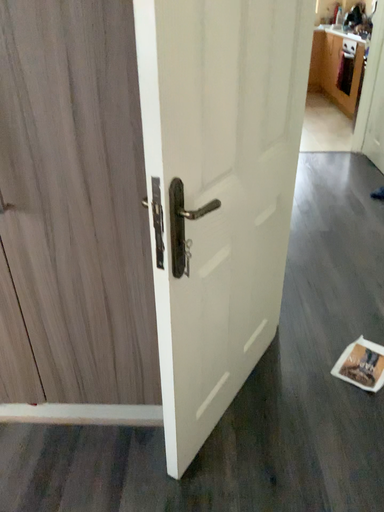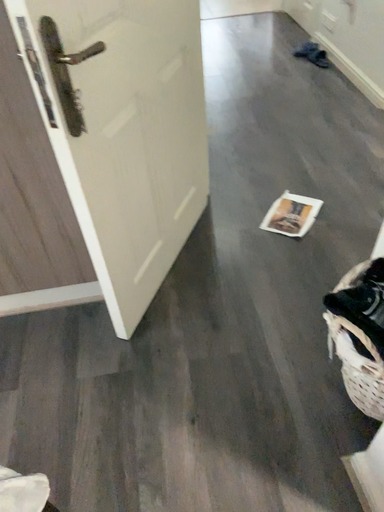
Question: Which way did the camera rotate in the video?

Choices:
 (A) rotated left
 (B) rotated right

Answer: (B)